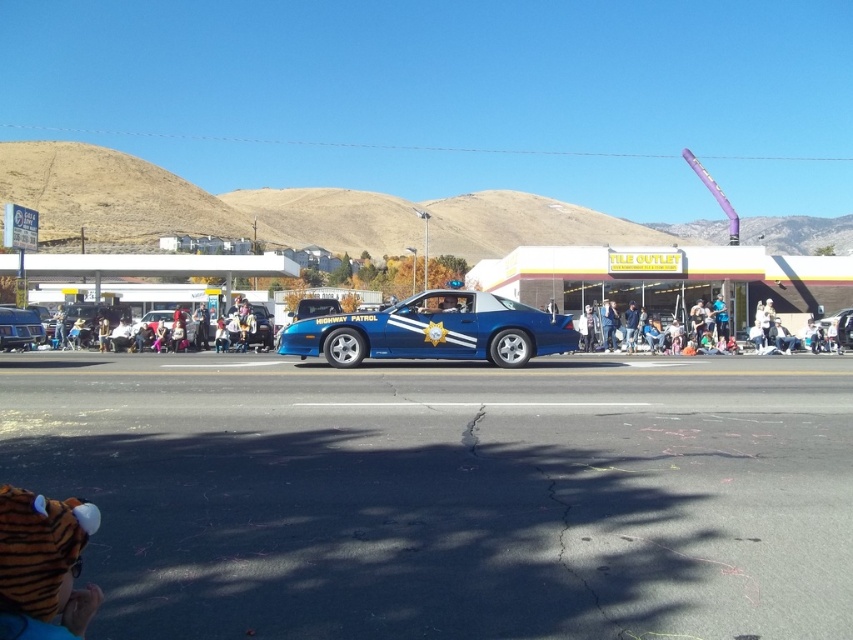
Is shiny blue car at center further to the viewer compared to tiger costume at lower left?

Yes, it is.

Who is more forward, (437, 308) or (9, 532)?

Point (9, 532) is more forward.

What do you see at coordinates (433, 332) in the screenshot? I see `shiny blue car at center` at bounding box center [433, 332].

Locate an element on the screen. shiny blue car at center is located at coordinates (433, 332).

Is tiger costume at lower left to the left of glossy blue car at left from the viewer's perspective?

In fact, tiger costume at lower left is to the right of glossy blue car at left.

Is point (73, 628) positioned after point (26, 314)?

No, (73, 628) is in front of (26, 314).

Which is behind, point (0, 544) or point (7, 348)?

Point (7, 348)

Where is `tiger costume at lower left`? tiger costume at lower left is located at coordinates (44, 561).

Who is positioned more to the right, shiny blue car at center or glossy blue car at left?

From the viewer's perspective, shiny blue car at center appears more on the right side.

Is shiny blue car at center thinner than glossy blue car at left?

Incorrect, shiny blue car at center's width is not less than glossy blue car at left's.

Between point (422, 317) and point (4, 348), which one is positioned in front?

Positioned in front is point (422, 317).

At what (x,y) coordinates should I click in order to perform the action: click on shiny blue car at center. Please return your answer as a coordinate pair (x, y). Looking at the image, I should click on (433, 332).